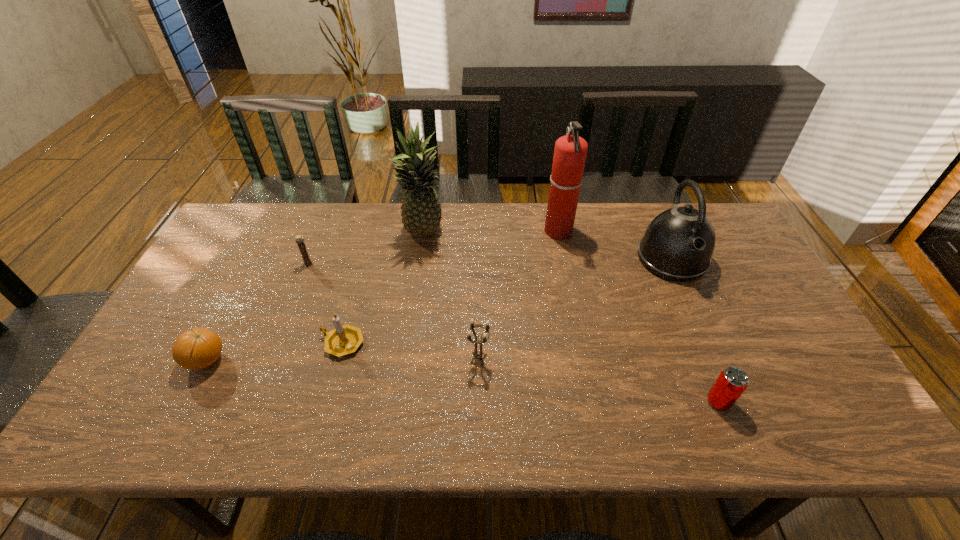
This screenshot has width=960, height=540. Identify the location of empty location between the fourth object from left to right and the orange. (315, 297).

Identify the location of unoccupied position between the sixth shortest object and the fourth object from left to right. (547, 246).

Where is `object that stands as the sixth closest to the third object from right to left`? This screenshot has height=540, width=960. object that stands as the sixth closest to the third object from right to left is located at coordinates (307, 262).

Point out which object is positioned as the fourth nearest to the rightmost candle holder. Please provide its 2D coordinates. Your answer should be formatted as a tuple, i.e. [(x, y)], where the tuple contains the x and y coordinates of a point satisfying the conditions above.

[(731, 383)]

This screenshot has width=960, height=540. What are the coordinates of `candle holder that is the closest to the second object from left to right` in the screenshot? It's located at pyautogui.click(x=343, y=340).

Identify the location of candle holder that stands as the closest to the third tallest object. Image resolution: width=960 pixels, height=540 pixels. (477, 354).

At what (x,y) coordinates should I click in order to perform the action: click on free space that satisfies the following two spatial constraints: 1. on the front side of the soda can; 2. on the left side of the fourth object from left to right. Please return your answer as a coordinate pair (x, y). Looking at the image, I should click on (400, 401).

Image resolution: width=960 pixels, height=540 pixels. I want to click on vacant area that satisfies the following two spatial constraints: 1. with the nozzle and gauge on the third object from right to left; 2. on the front side of the orange, so click(x=584, y=361).

In order to click on free space that satisfies the following two spatial constraints: 1. with the nozzle and gauge on the fire extinguisher; 2. on the right side of the nearest object in this screenshot , I will do `click(592, 401)`.